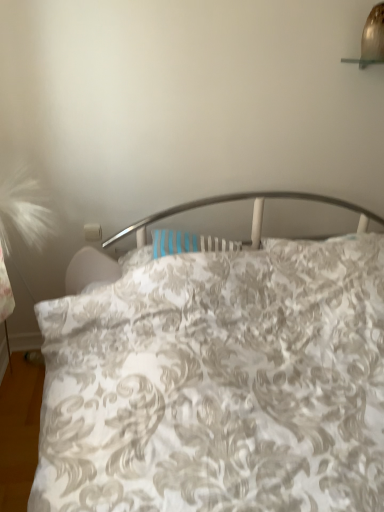
What do you see at coordinates (371, 39) in the screenshot? The height and width of the screenshot is (512, 384). I see `metallic gold bedside lamp at upper right` at bounding box center [371, 39].

What is the approximate width of metallic gold bedside lamp at upper right?

The width of metallic gold bedside lamp at upper right is 6.22 inches.

Locate an element on the screen. metallic gold bedside lamp at upper right is located at coordinates click(371, 39).

At what (x,y) coordinates should I click in order to perform the action: click on metallic gold bedside lamp at upper right. Please return your answer as a coordinate pair (x, y). The image size is (384, 512). Looking at the image, I should click on (371, 39).